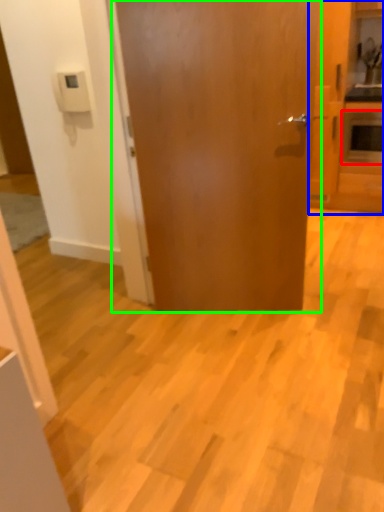
Question: Estimate the real-world distances between objects in this image. Which object is closer to appliance (highlighted by a red box), cabinetry (highlighted by a blue box) or door (highlighted by a green box)?

Choices:
 (A) cabinetry
 (B) door

Answer: (A)